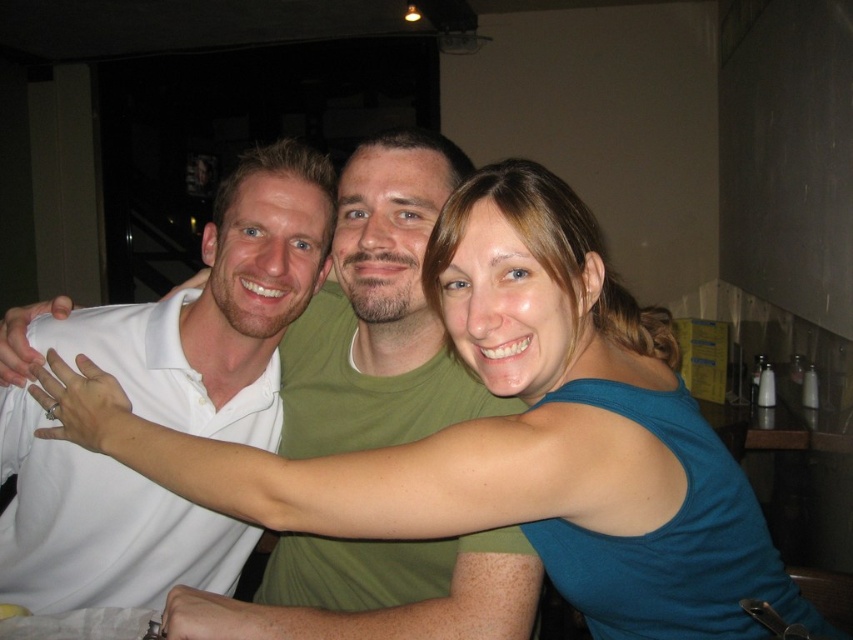
Question: Can you confirm if blue fabric at center is positioned to the left of white matte shirt at left?

Choices:
 (A) yes
 (B) no

Answer: (B)

Question: Is blue fabric at center thinner than white matte shirt at left?

Choices:
 (A) no
 (B) yes

Answer: (A)

Question: Which point is closer to the camera?

Choices:
 (A) blue fabric at center
 (B) white matte shirt at left

Answer: (A)

Question: Which point is farther to the camera?

Choices:
 (A) (170, 577)
 (B) (664, 420)

Answer: (A)

Question: Is blue fabric at center to the left of white matte shirt at left from the viewer's perspective?

Choices:
 (A) no
 (B) yes

Answer: (A)